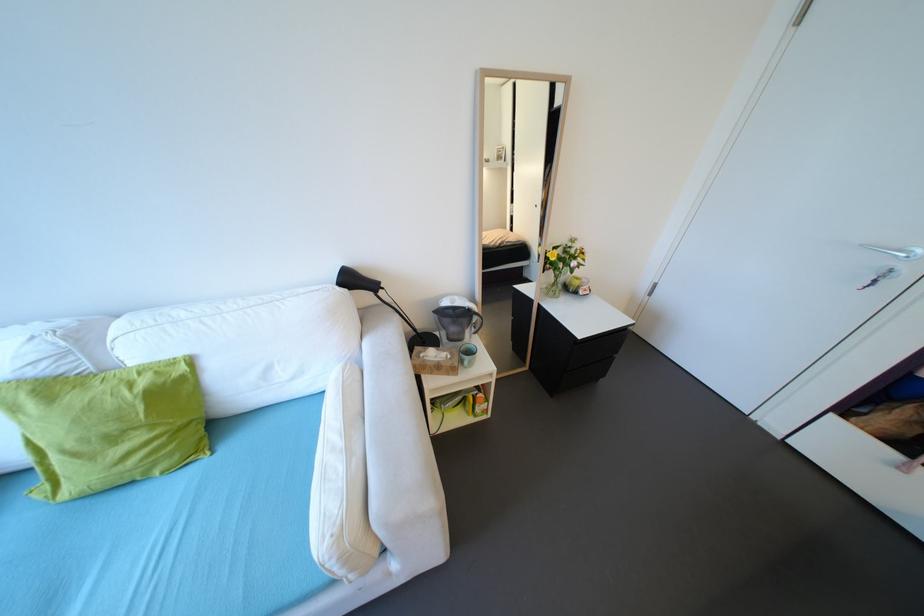
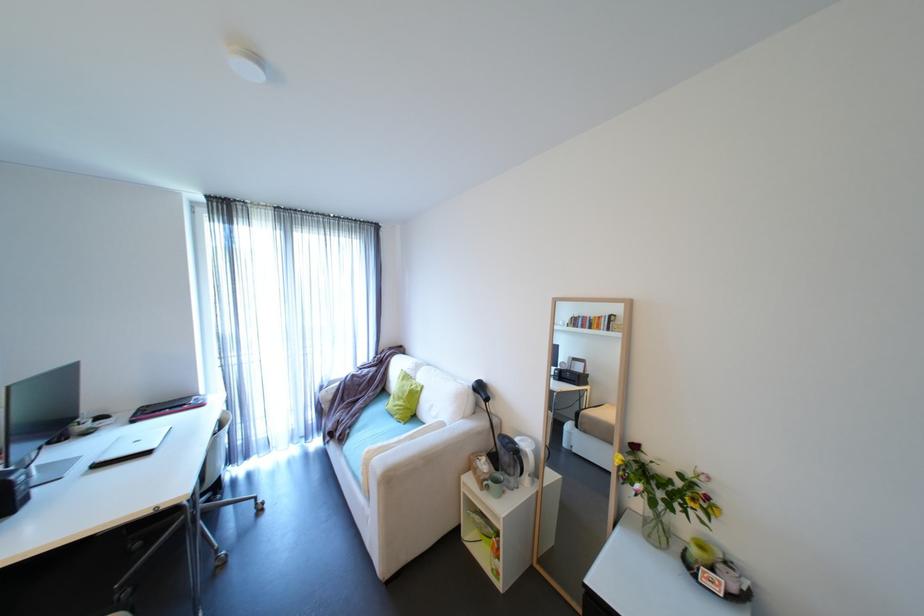
The point at (x=160, y=428) is marked in the first image. Where is the corresponding point in the second image?

(411, 402)